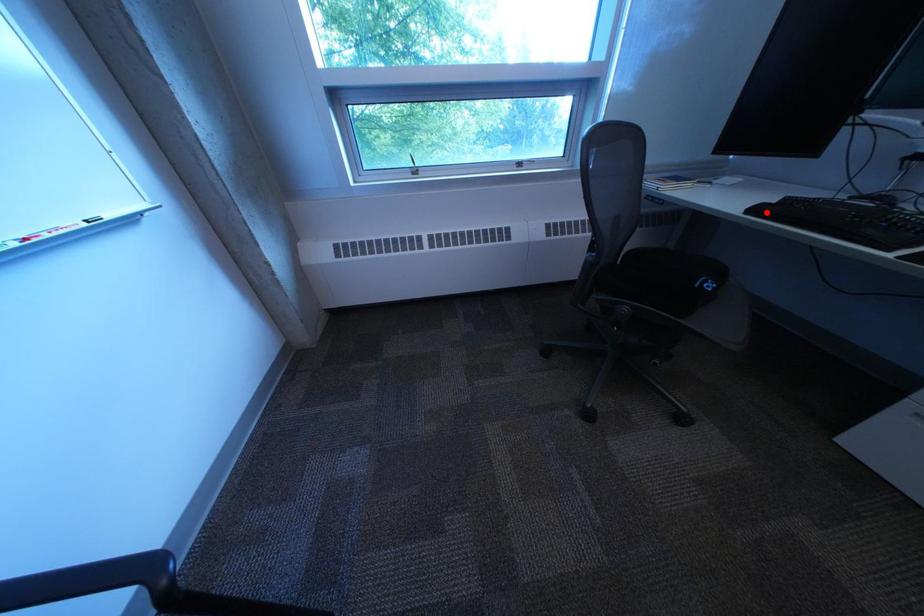
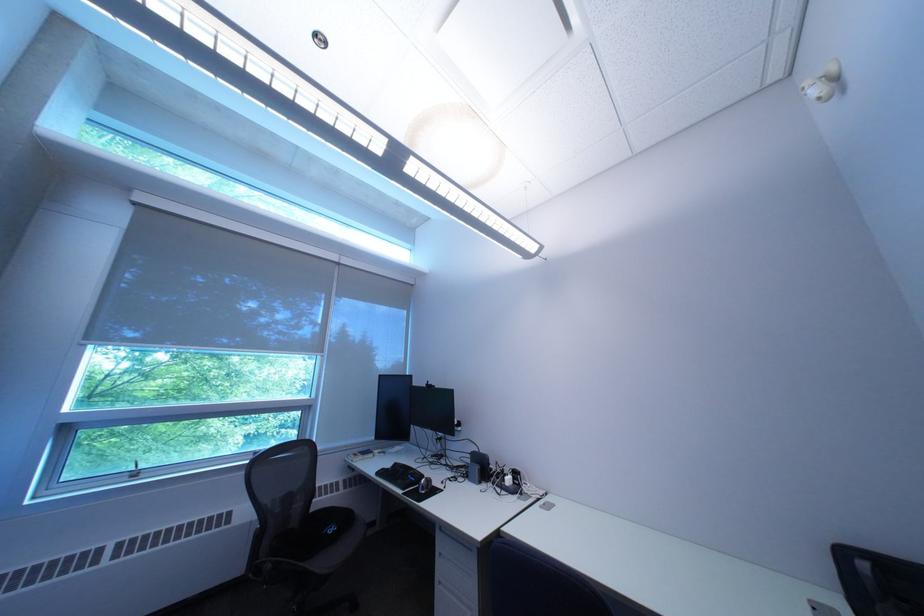
Find the pixel in the second image that matches the highlighted location in the first image.

(393, 475)